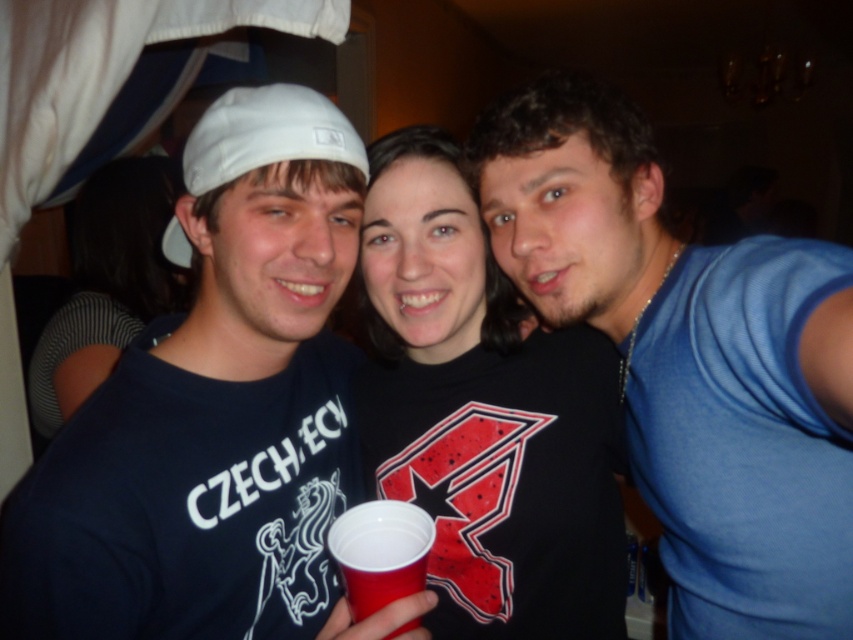
Question: Can you confirm if matte white cap at center is positioned to the right of black matte shirt at center?

Choices:
 (A) no
 (B) yes

Answer: (A)

Question: Observing the image, what is the correct spatial positioning of black matte shirt at center in reference to red plastic cup at center?

Choices:
 (A) below
 (B) above

Answer: (B)

Question: Can you confirm if blue mesh tank top at right is positioned to the right of red plastic cup at center?

Choices:
 (A) yes
 (B) no

Answer: (A)

Question: Which point is closer to the camera taking this photo?

Choices:
 (A) 386,579
 (B) 74,392
 (C) 247,609
 (D) 393,304

Answer: (A)

Question: Among these objects, which one is farthest from the camera?

Choices:
 (A) striped fabric shirt at center
 (B) red plastic cup at center

Answer: (A)

Question: Which object is positioned farthest from the blue mesh tank top at right?

Choices:
 (A) striped fabric shirt at center
 (B) red plastic cup at center

Answer: (A)